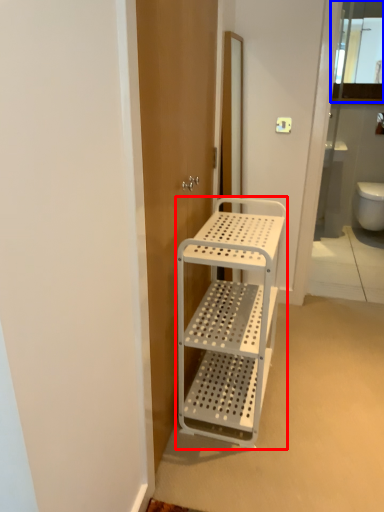
Question: Which of the following is the farthest to the observer, furniture (highlighted by a red box) or cabinet (highlighted by a blue box)?

Choices:
 (A) furniture
 (B) cabinet

Answer: (B)